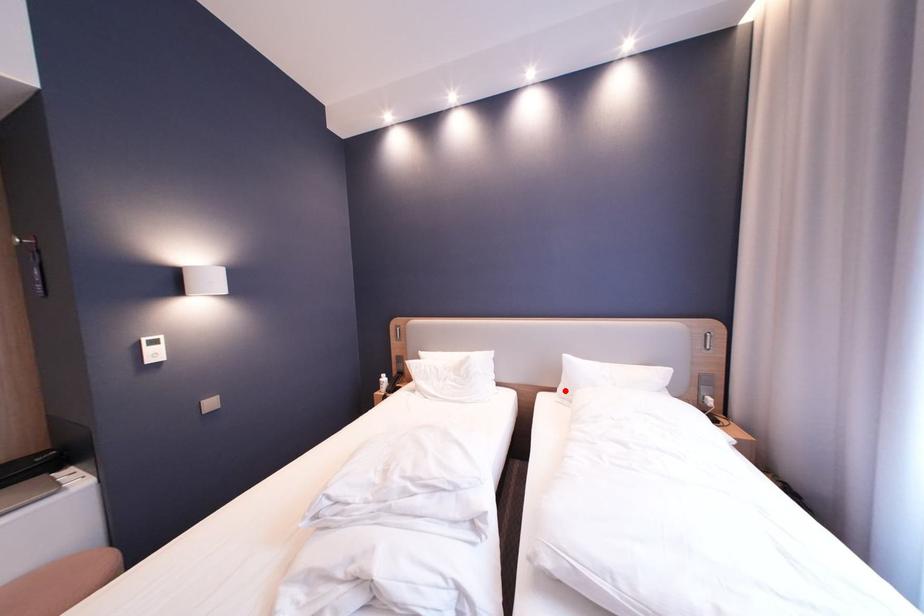
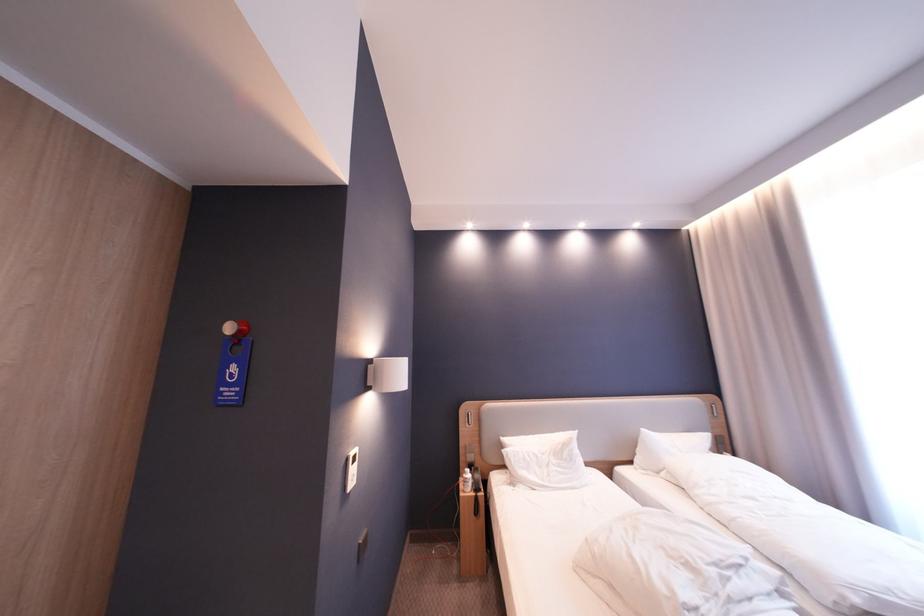
In the second image, find the point that corresponds to the highlighted location in the first image.

(641, 464)